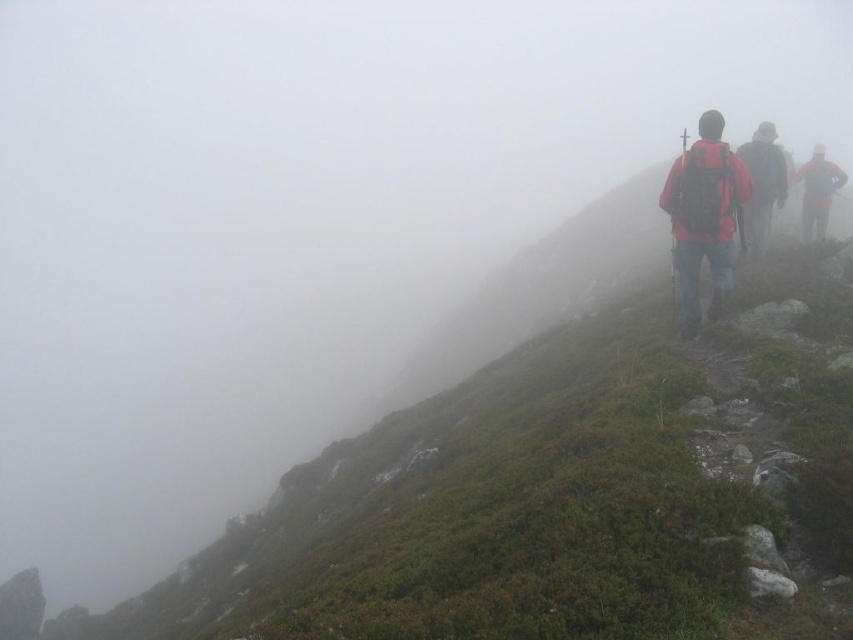
Question: Which of the following is the closest to the observer?

Choices:
 (A) (675, 182)
 (B) (814, 218)

Answer: (A)

Question: Which object appears closest to the camera in this image?

Choices:
 (A) red backpack at center
 (B) red matte jacket at upper right

Answer: (A)

Question: In this image, where is matte pink backpack at right located relative to red backpack at center?

Choices:
 (A) above
 (B) below

Answer: (B)

Question: Does matte pink backpack at right come behind red backpack at center?

Choices:
 (A) yes
 (B) no

Answer: (B)

Question: Estimate the real-world distances between objects in this image. Which object is farther from the red matte jacket at upper right?

Choices:
 (A) matte pink backpack at right
 (B) red backpack at center

Answer: (A)

Question: Is red backpack at center below red matte jacket at upper right?

Choices:
 (A) yes
 (B) no

Answer: (B)